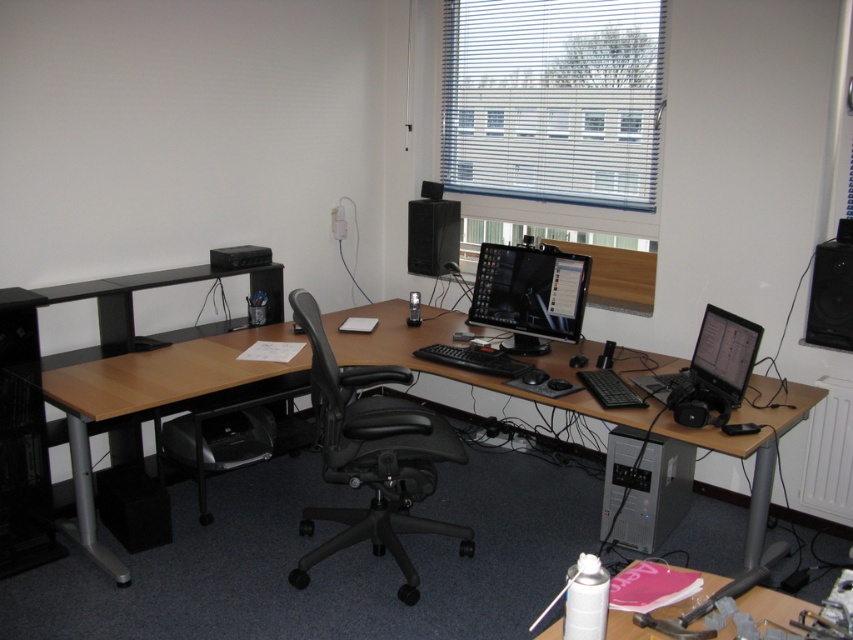
Which is more to the right, black plastic speaker at right or black plastic speaker at upper center?

Positioned to the right is black plastic speaker at right.

Who is more distant from viewer, [827,301] or [445,272]?

The point [445,272] is behind.

Image resolution: width=853 pixels, height=640 pixels. What are the coordinates of `black plastic speaker at right` in the screenshot? It's located at (830, 298).

Does matte black monitor at center have a lesser height compared to white plastic spray can at lower right?

No, matte black monitor at center is not shorter than white plastic spray can at lower right.

Is point (485, 268) behind point (761, 596)?

That is True.

Is point (552, 321) closer to camera compared to point (628, 627)?

No, (552, 321) is behind (628, 627).

Find the location of a particular element. The height and width of the screenshot is (640, 853). matte black monitor at center is located at coordinates (529, 294).

From the picture: Who is lower down, wooden desk at center or black plastic printer at lower left?

black plastic printer at lower left is lower down.

Between point (225, 358) and point (253, 417), which one is positioned in front?

Point (225, 358) is in front.

The width and height of the screenshot is (853, 640). Identify the location of wooden desk at center. (155, 401).